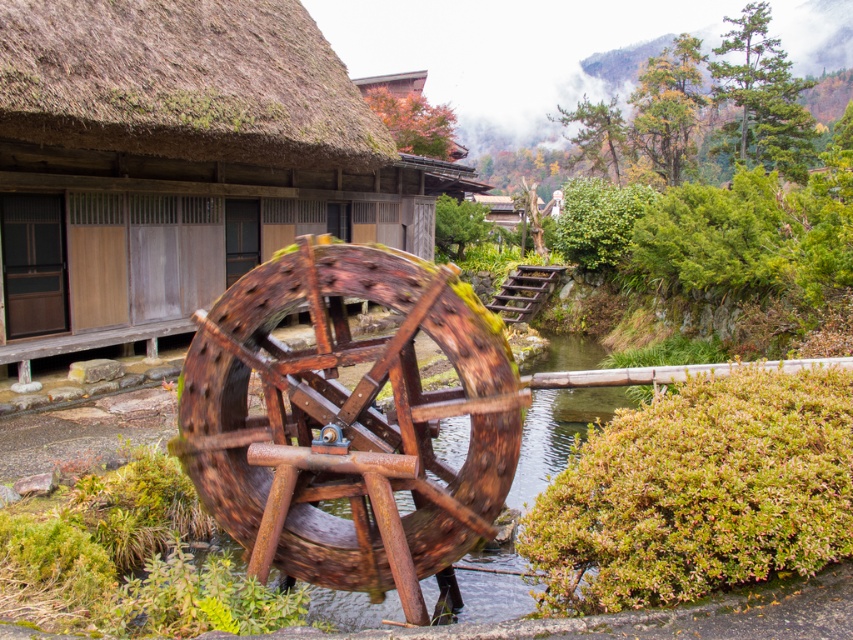
Based on the photo, does rusty wood water wheel at center have a lesser width compared to rusty wood wagon wheel at center?

Yes.

Does rusty wood water wheel at center appear over rusty wood wagon wheel at center?

Yes, rusty wood water wheel at center is above rusty wood wagon wheel at center.

You are a GUI agent. You are given a task and a screenshot of the screen. Output one action in this format:
    pyautogui.click(x=<x>, y=<y>)
    Task: Click on the rusty wood water wheel at center
    
    Given the screenshot: What is the action you would take?
    pyautogui.click(x=167, y=161)